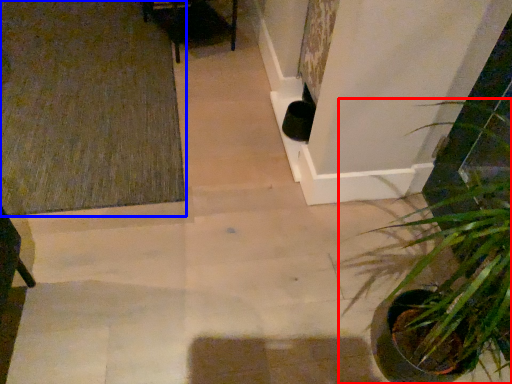
Question: Which object is further to the camera taking this photo, houseplant (highlighted by a red box) or doormat (highlighted by a blue box)?

Choices:
 (A) houseplant
 (B) doormat

Answer: (B)